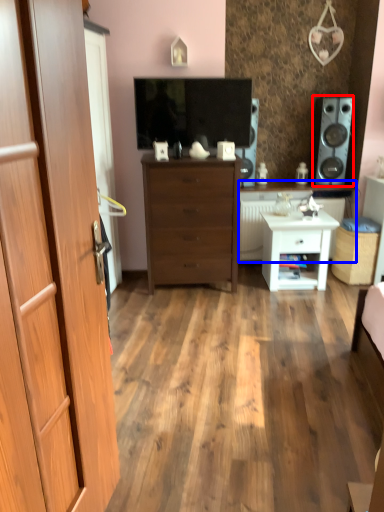
Question: Among these objects, which one is farthest to the camera, speaker (highlighted by a red box) or counter top (highlighted by a blue box)?

Choices:
 (A) speaker
 (B) counter top

Answer: (B)